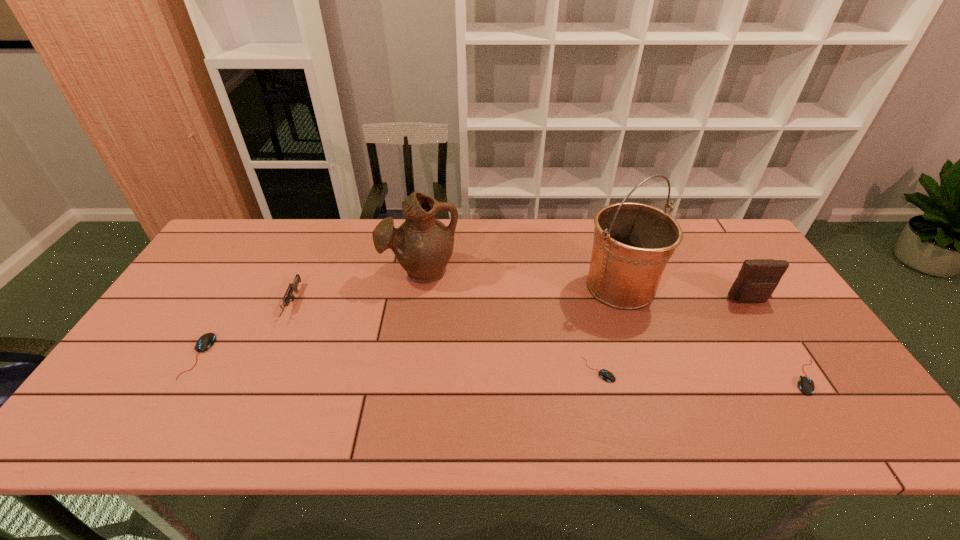
At what (x,y) coordinates should I click in order to perform the action: click on the closest object relative to the pitcher. Please return your answer as a coordinate pair (x, y). The height and width of the screenshot is (540, 960). Looking at the image, I should click on (293, 286).

The image size is (960, 540). Find the location of `object that is the fifth closest one to the second mouse from right to left`. object that is the fifth closest one to the second mouse from right to left is located at coordinates (293, 286).

This screenshot has width=960, height=540. Identify the location of mouse that is the second closest to the shortest mouse. (207, 340).

Select which mouse appears as the closest to the gun. Please provide its 2D coordinates. Your answer should be formatted as a tuple, i.e. [(x, y)], where the tuple contains the x and y coordinates of a point satisfying the conditions above.

[(207, 340)]

This screenshot has height=540, width=960. Find the location of `vacant point that satisfies the following two spatial constraints: 1. at the spout of the second mouse from left to right; 2. on the left side of the third object from left to right`. vacant point that satisfies the following two spatial constraints: 1. at the spout of the second mouse from left to right; 2. on the left side of the third object from left to right is located at coordinates (406, 370).

Locate an element on the screen. blank space that satisfies the following two spatial constraints: 1. at the spout of the shortest mouse; 2. on the left side of the fifth object from right to left is located at coordinates (406, 370).

Where is `free space that satisfies the following two spatial constraints: 1. aimed along the barrel of the fourth shortest object; 2. on the left side of the rightmost mouse`? The height and width of the screenshot is (540, 960). free space that satisfies the following two spatial constraints: 1. aimed along the barrel of the fourth shortest object; 2. on the left side of the rightmost mouse is located at coordinates (259, 377).

Where is `free space that satisfies the following two spatial constraints: 1. with an open flap on the third tallest object; 2. on the right side of the rightmost mouse`? The height and width of the screenshot is (540, 960). free space that satisfies the following two spatial constraints: 1. with an open flap on the third tallest object; 2. on the right side of the rightmost mouse is located at coordinates (798, 377).